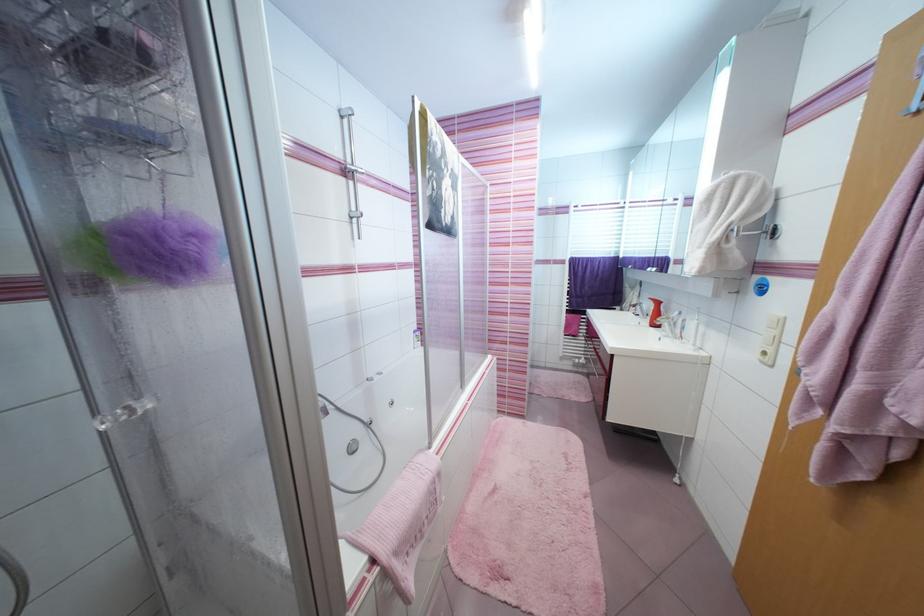
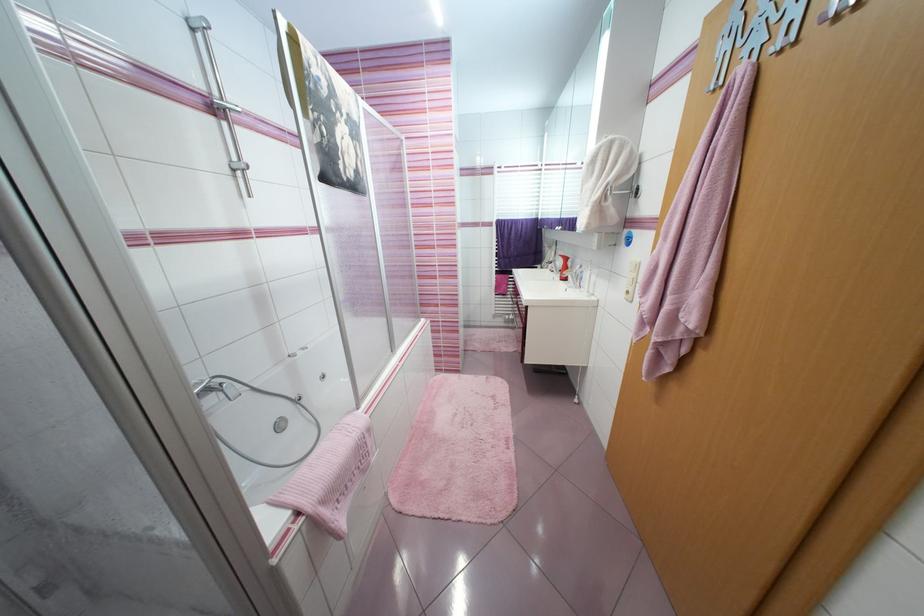
In a continuous first-person perspective shot, in which direction is the camera moving?

The cameraman walked toward right, backward.